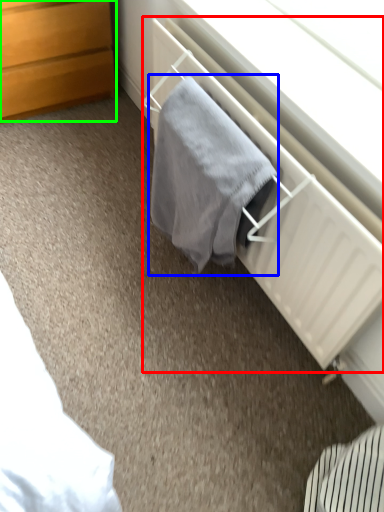
Question: Considering the real-world distances, which object is closest to radiator (highlighted by a red box)? bath towel (highlighted by a blue box) or chest of drawers (highlighted by a green box).

Choices:
 (A) bath towel
 (B) chest of drawers

Answer: (A)